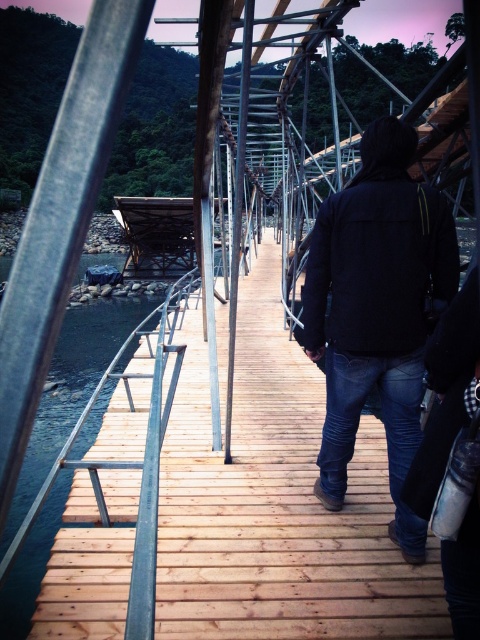
Question: Which point is farther from the camera taking this photo?

Choices:
 (A) (159, 445)
 (B) (418, 259)

Answer: (B)

Question: Does dark blue jeans at center appear on the right side of brown wooden river at left?

Choices:
 (A) no
 (B) yes

Answer: (B)

Question: Is dark blue jeans at center closer to the viewer compared to brown wooden river at left?

Choices:
 (A) yes
 (B) no

Answer: (B)

Question: Does dark blue jeans at center have a greater width compared to brown wooden river at left?

Choices:
 (A) no
 (B) yes

Answer: (A)